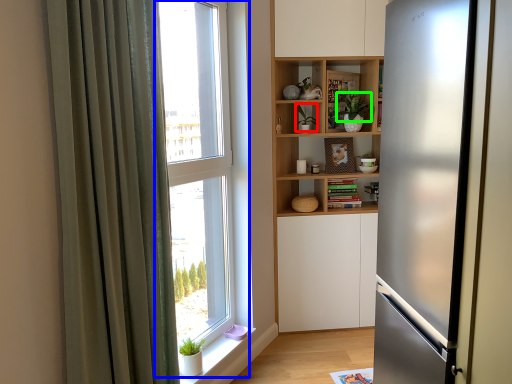
Question: Based on their relative distances, which object is farther from plant (highlighted by a red box)? Choose from window (highlighted by a blue box) and plant (highlighted by a green box).

Choices:
 (A) window
 (B) plant

Answer: (A)